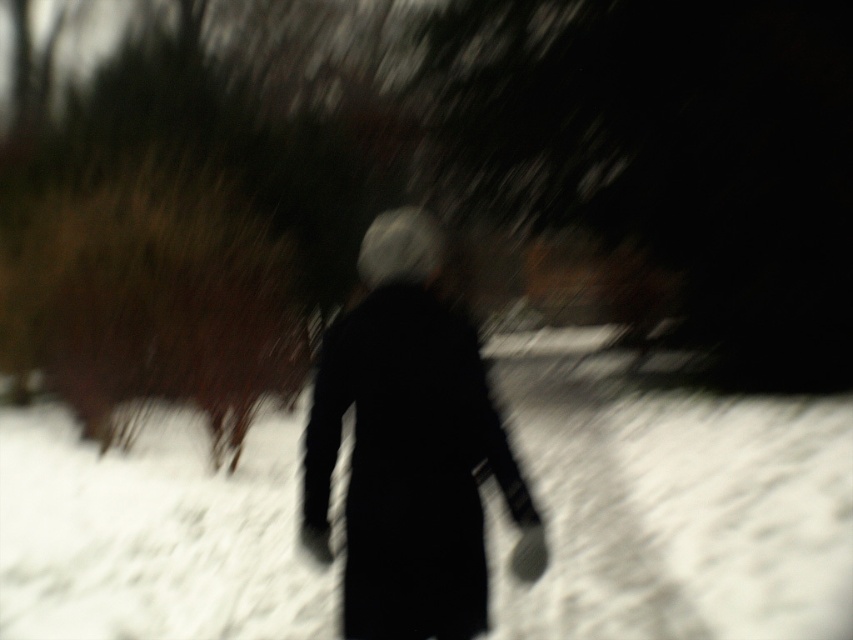
Can you confirm if white fluffy snow at center is taller than black matte coat at center?

Yes, white fluffy snow at center is taller than black matte coat at center.

Does point (845, 557) lie in front of point (436, 387)?

No.

Where is `white fluffy snow at center`? Image resolution: width=853 pixels, height=640 pixels. white fluffy snow at center is located at coordinates (670, 504).